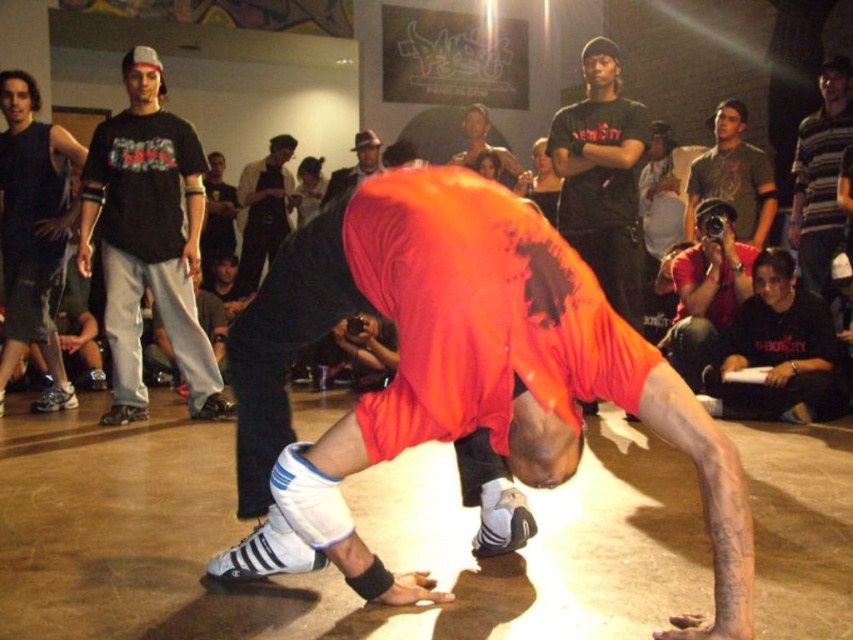
Question: Where is black cotton shirt at center located in relation to smooth skin face at center in the image?

Choices:
 (A) below
 (B) above

Answer: (A)

Question: Is matte black tank top at left bigger than smooth skin face at center?

Choices:
 (A) no
 (B) yes

Answer: (B)

Question: Estimate the real-world distances between objects in this image. Which object is farther from the dark brown leather jacket at upper center?

Choices:
 (A) striped cotton shirt at upper right
 (B) black matte shirt at lower right
 (C) matte black camera at upper right
 (D) matte black tank top at left

Answer: (A)

Question: Which is nearer to the black matte shirt at center?

Choices:
 (A) smooth leather hat at upper center
 (B) black matte shirt at lower right
 (C) smooth skin face at upper center

Answer: (B)

Question: Among these points, which one is nearest to the camera?

Choices:
 (A) (554, 170)
 (B) (315, 195)
 (C) (589, 170)

Answer: (C)

Question: Is matte black t-shirt at left to the right of orange fabric shirt at center from the viewer's perspective?

Choices:
 (A) yes
 (B) no

Answer: (B)